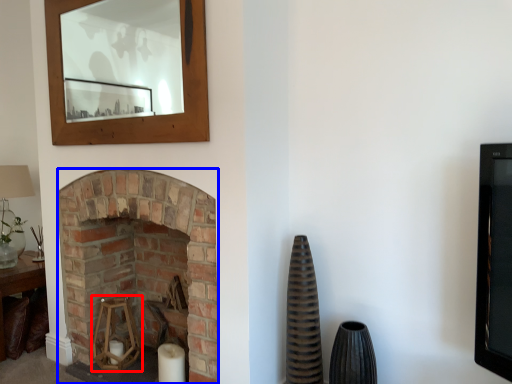
Question: Among these objects, which one is nearest to the camera, candle holder (highlighted by a red box) or fireplace (highlighted by a blue box)?

Choices:
 (A) candle holder
 (B) fireplace

Answer: (B)